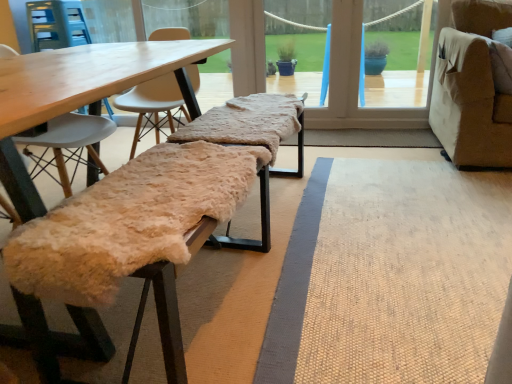
Question: From a real-world perspective, is fuzzy woolen bench at center, acting as the second park bench starting from the bottom, above or below fuzzy beige bench at lower left, which is the 1th park bench from bottom to top?

Choices:
 (A) above
 (B) below

Answer: (A)

Question: Considering the positions of fuzzy woolen bench at center, marked as the 1th park bench in a top-to-bottom arrangement, and fuzzy beige bench at lower left, arranged as the 2th park bench when viewed from the top, in the image, is fuzzy woolen bench at center, marked as the 1th park bench in a top-to-bottom arrangement, wider or thinner than fuzzy beige bench at lower left, arranged as the 2th park bench when viewed from the top,?

Choices:
 (A) wide
 (B) thin

Answer: (A)

Question: Is fuzzy woolen bench at center, acting as the second park bench starting from the bottom, inside or outside of fuzzy beige bench at lower left, which is the 1th park bench from bottom to top?

Choices:
 (A) inside
 (B) outside

Answer: (B)

Question: In terms of height, does fuzzy beige bench at lower left, which is the 1th park bench from bottom to top, look taller or shorter compared to fuzzy woolen bench at center, marked as the 1th park bench in a top-to-bottom arrangement?

Choices:
 (A) short
 (B) tall

Answer: (B)

Question: Considering the relative positions of fuzzy beige bench at lower left, which is the 1th park bench from bottom to top, and fuzzy woolen bench at center, acting as the second park bench starting from the bottom, in the image provided, is fuzzy beige bench at lower left, which is the 1th park bench from bottom to top, to the left or to the right of fuzzy woolen bench at center, acting as the second park bench starting from the bottom,?

Choices:
 (A) left
 (B) right

Answer: (A)

Question: Considering the positions of fuzzy beige bench at lower left, arranged as the 2th park bench when viewed from the top, and fuzzy woolen bench at center, acting as the second park bench starting from the bottom, in the image, is fuzzy beige bench at lower left, arranged as the 2th park bench when viewed from the top, bigger or smaller than fuzzy woolen bench at center, acting as the second park bench starting from the bottom,?

Choices:
 (A) small
 (B) big

Answer: (B)

Question: From the image's perspective, is fuzzy beige bench at lower left, arranged as the 2th park bench when viewed from the top, located above or below fuzzy woolen bench at center, marked as the 1th park bench in a top-to-bottom arrangement?

Choices:
 (A) above
 (B) below

Answer: (B)